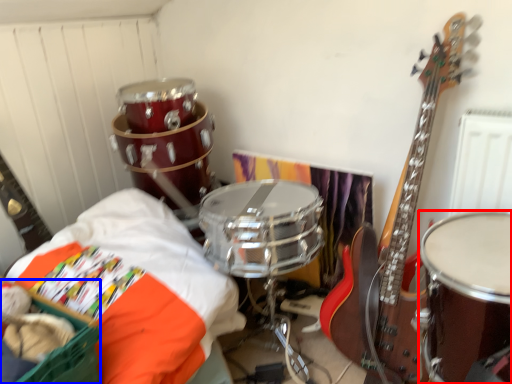
Question: Which point is closer to the camera, drum (highlighted by a red box) or basket (highlighted by a blue box)?

Choices:
 (A) drum
 (B) basket

Answer: (B)